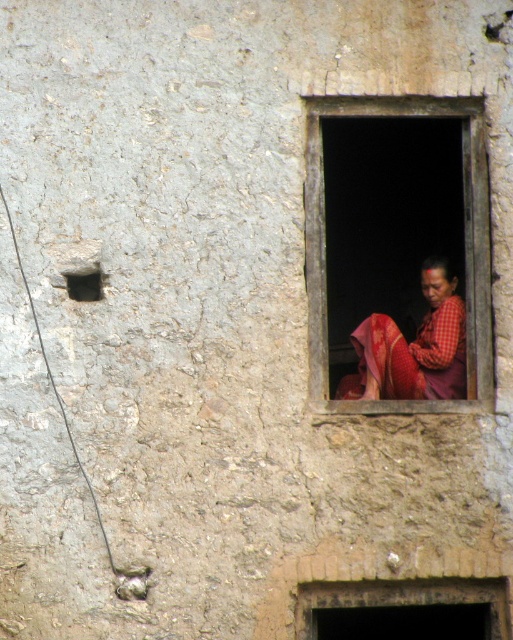
Question: Is matte red fabric at center thinner than dark gray concrete hole at upper left?

Choices:
 (A) no
 (B) yes

Answer: (A)

Question: Can you confirm if matte red fabric at center is positioned above red plaid fabric at window?

Choices:
 (A) no
 (B) yes

Answer: (B)

Question: Among these points, which one is farthest from the camera?

Choices:
 (A) (71, 282)
 (B) (312, 228)
 (C) (366, 323)

Answer: (C)

Question: Which object appears closest to the camera in this image?

Choices:
 (A) red plaid fabric at window
 (B) dark gray concrete hole at upper left

Answer: (B)

Question: Which point appears closest to the camera in this image?

Choices:
 (A) (450, 115)
 (B) (435, 358)
 (C) (75, 285)

Answer: (C)

Question: Can you confirm if matte red fabric at center is smaller than dark gray concrete hole at upper left?

Choices:
 (A) no
 (B) yes

Answer: (A)